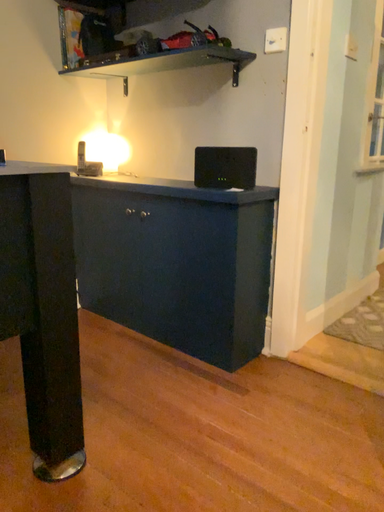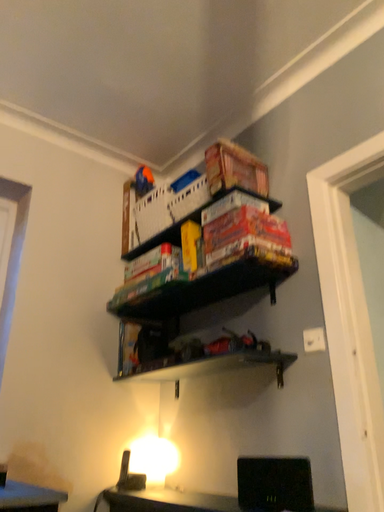
Question: Which way did the camera rotate in the video?

Choices:
 (A) rotated right
 (B) rotated left

Answer: (B)